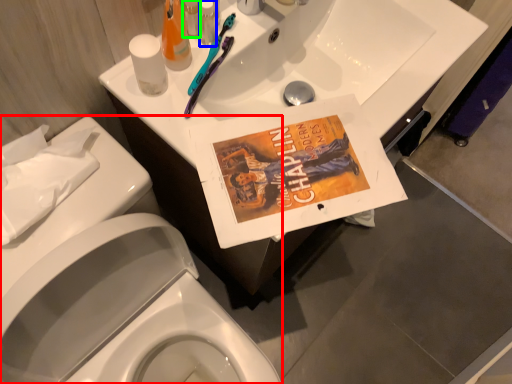
Question: Which object is the closest to the porcelain (highlighted by a red box)? Choose among these: toiletry (highlighted by a blue box) or toiletry (highlighted by a green box).

Choices:
 (A) toiletry
 (B) toiletry

Answer: (B)